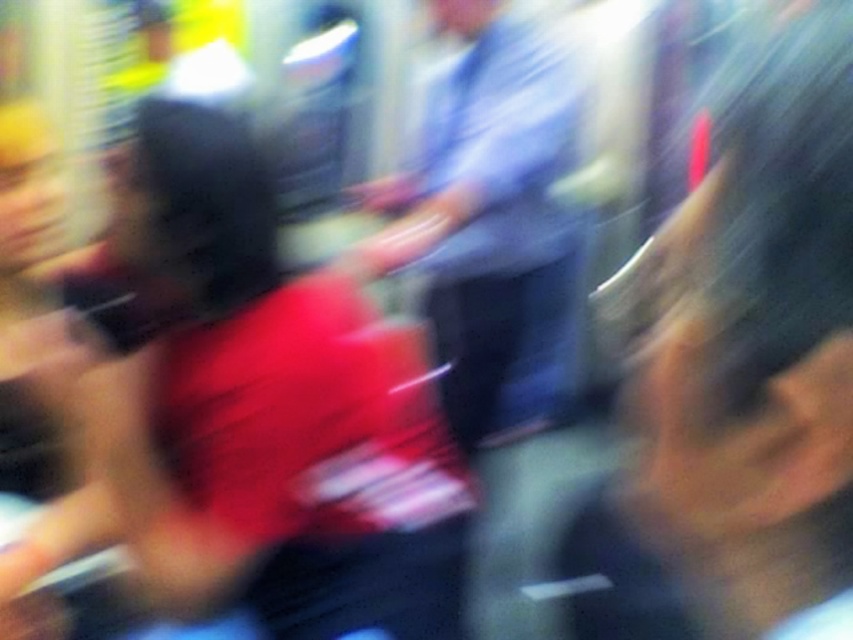
You are a photographer who just took a motion blurred photo in a busy subway station. You notice two shirts in the center of the image, a matte red shirt at center and a light blue shirt at center. Which shirt appears shorter in the photo?

The matte red shirt at center is not as tall as light blue shirt at center, so the matte red shirt at center appears shorter.

You are standing in a crowded indoor area like a subway station and see a person wearing a matte red shirt at center. There is a point marked at coordinates (268, 408). Is this point located on the matte red shirt at center?

Yes, the point (268, 408) is on the matte red shirt at center according to the description.